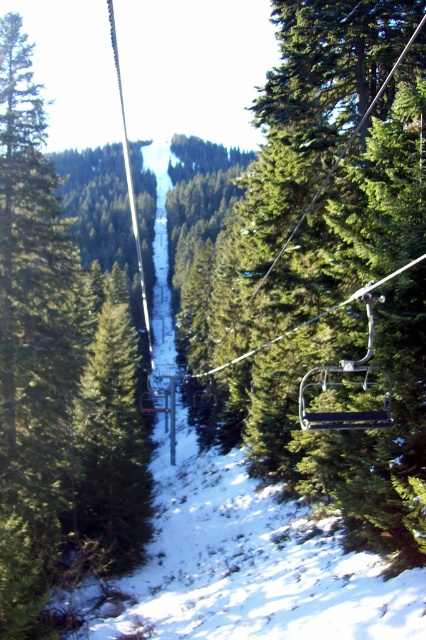
You are sitting in the green matte chair at center and want to look at the green matte tree at center. Which object is nearer to you?

The green matte chair at center is closer to the viewer than the green matte tree at center, so the green matte chair at center is nearer to you.